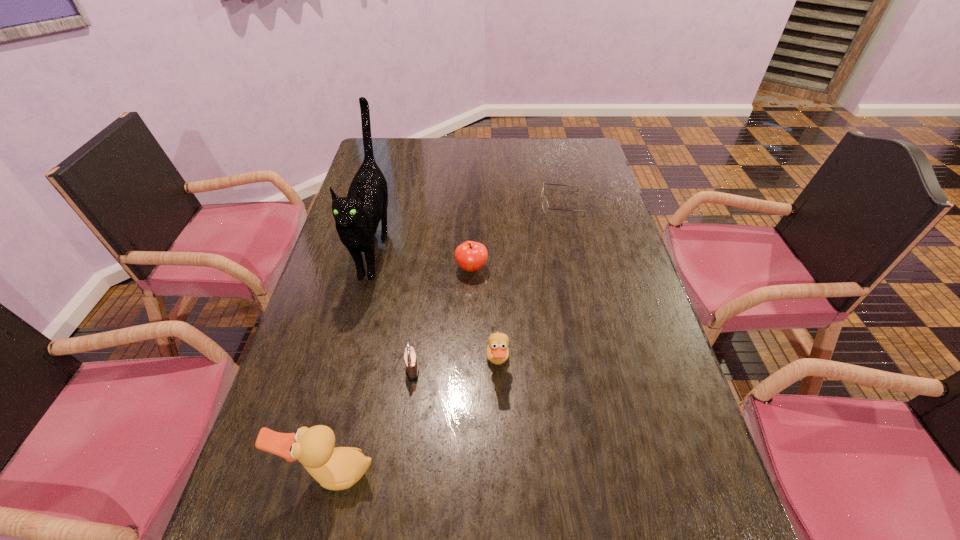
At what (x,y) coordinates should I click in order to perform the action: click on blank region between the padlock and the apple. Please return your answer as a coordinate pair (x, y). Looking at the image, I should click on (442, 319).

You are a GUI agent. You are given a task and a screenshot of the screen. Output one action in this format:
    pyautogui.click(x=<x>, y=<y>)
    Task: Click on the free space that is in between the apple and the rightmost object
    
    Given the screenshot: What is the action you would take?
    pyautogui.click(x=516, y=236)

The height and width of the screenshot is (540, 960). I want to click on vacant point located between the right duck and the fifth shortest object, so click(x=415, y=418).

This screenshot has height=540, width=960. What are the coordinates of `vacant area that lies between the cat and the farther duck` in the screenshot? It's located at (436, 306).

Where is `blank region between the left duck and the cat`? This screenshot has height=540, width=960. blank region between the left duck and the cat is located at coordinates (353, 362).

This screenshot has width=960, height=540. I want to click on vacant space that is in between the rightmost object and the apple, so click(x=516, y=236).

Locate an element on the screen. Image resolution: width=960 pixels, height=540 pixels. object that is the second closest to the third object from left to right is located at coordinates [x=339, y=468].

Choose which object is the fourth nearest neighbor to the cat. Please provide its 2D coordinates. Your answer should be formatted as a tuple, i.e. [(x, y)], where the tuple contains the x and y coordinates of a point satisfying the conditions above.

[(339, 468)]

This screenshot has width=960, height=540. Find the location of `vacant area in the image that satisfies the following two spatial constraints: 1. on the beak of the right duck; 2. on the beak of the taller duck`. vacant area in the image that satisfies the following two spatial constraints: 1. on the beak of the right duck; 2. on the beak of the taller duck is located at coordinates (501, 474).

Locate an element on the screen. The width and height of the screenshot is (960, 540). free space that satisfies the following two spatial constraints: 1. on the face of the cat; 2. on the right side of the padlock is located at coordinates (344, 370).